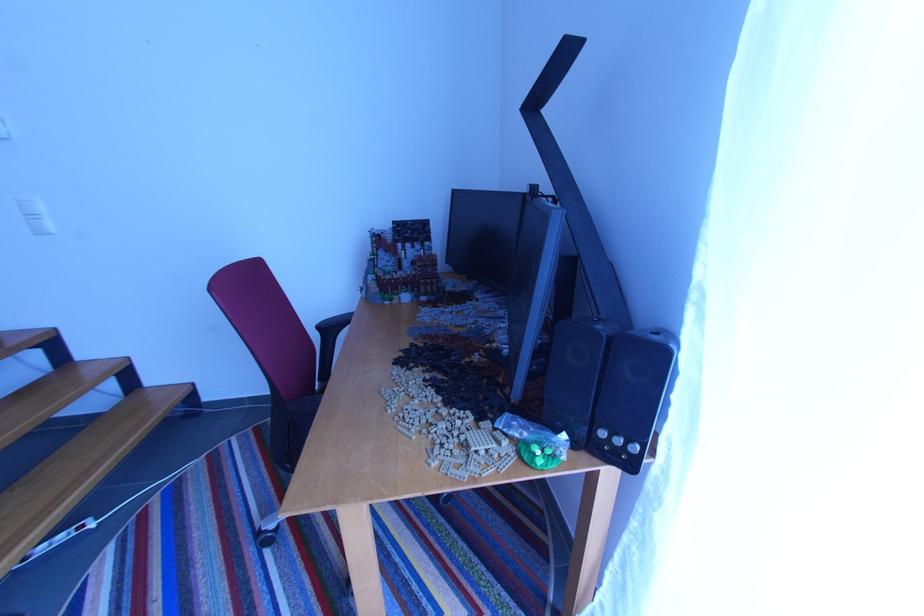
The width and height of the screenshot is (924, 616). What are the coordinates of `chair sitting surface` in the screenshot? It's located at (300, 421).